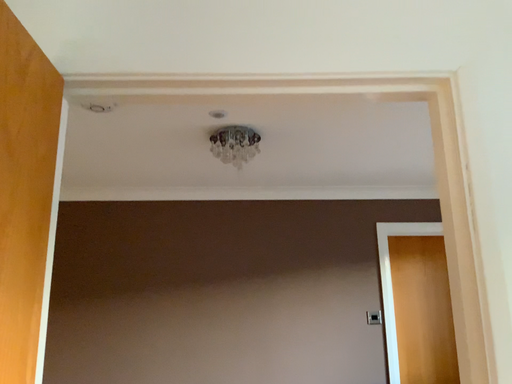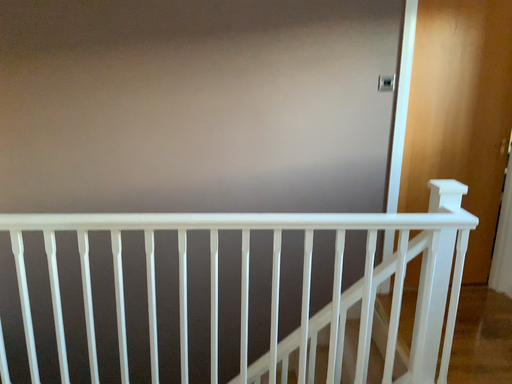
Question: Which way did the camera rotate in the video?

Choices:
 (A) rotated downward
 (B) rotated upward

Answer: (A)